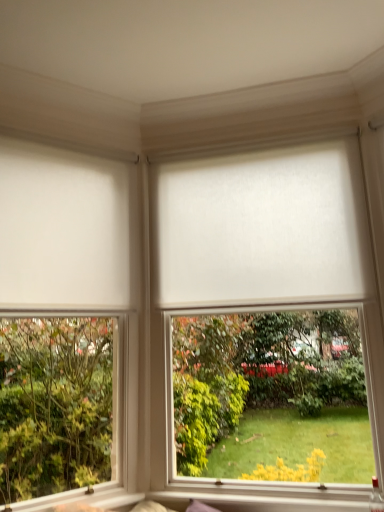
Question: Is white matte roller blind at center, positioned as the 1th window in right-to-left order, next to white matte blind at center, the 1th blind from the right?

Choices:
 (A) no
 (B) yes

Answer: (A)

Question: From the image's perspective, would you say white matte roller blind at center, positioned as the 2th window in left-to-right order, is positioned over white matte blind at center, the 1th blind from the right?

Choices:
 (A) yes
 (B) no

Answer: (B)

Question: Considering the relative positions of white matte roller blind at center, positioned as the 1th window in right-to-left order, and white matte blind at center, arranged as the second blind when viewed from the left, in the image provided, is white matte roller blind at center, positioned as the 1th window in right-to-left order, to the left of white matte blind at center, arranged as the second blind when viewed from the left, from the viewer's perspective?

Choices:
 (A) yes
 (B) no

Answer: (B)

Question: Considering the relative sizes of white matte roller blind at center, positioned as the 2th window in left-to-right order, and white matte blind at center, the 1th blind from the right, in the image provided, is white matte roller blind at center, positioned as the 2th window in left-to-right order, wider than white matte blind at center, the 1th blind from the right,?

Choices:
 (A) no
 (B) yes

Answer: (B)

Question: Is white matte roller blind at center, positioned as the 2th window in left-to-right order, facing away from white matte blind at center, arranged as the second blind when viewed from the left?

Choices:
 (A) yes
 (B) no

Answer: (A)

Question: Can you confirm if white matte roller blind at center, positioned as the 1th window in right-to-left order, is thinner than white matte blind at center, arranged as the second blind when viewed from the left?

Choices:
 (A) yes
 (B) no

Answer: (B)

Question: Does white matte roller blind at center, positioned as the 1th window in right-to-left order, have a lesser height compared to white matte roller blind at left, which ranks as the 1th window in left-to-right order?

Choices:
 (A) no
 (B) yes

Answer: (B)

Question: Does white matte roller blind at center, positioned as the 2th window in left-to-right order, have a greater height compared to white matte roller blind at left, the second window positioned from the right?

Choices:
 (A) no
 (B) yes

Answer: (A)

Question: Can you confirm if white matte roller blind at center, positioned as the 1th window in right-to-left order, is bigger than white matte roller blind at left, the second window positioned from the right?

Choices:
 (A) no
 (B) yes

Answer: (B)

Question: Does white matte roller blind at center, positioned as the 1th window in right-to-left order, lie in front of white matte roller blind at left, which ranks as the 1th window in left-to-right order?

Choices:
 (A) no
 (B) yes

Answer: (A)

Question: Can we say white matte roller blind at center, positioned as the 1th window in right-to-left order, lies outside white matte roller blind at left, the second window positioned from the right?

Choices:
 (A) no
 (B) yes

Answer: (B)

Question: From the image's perspective, does white matte roller blind at center, positioned as the 1th window in right-to-left order, appear higher than white matte roller blind at left, the second window positioned from the right?

Choices:
 (A) no
 (B) yes

Answer: (B)

Question: Considering the relative sizes of white matte roller blind at center, positioned as the 1th window in right-to-left order, and white matte blind at left, positioned as the 2th blind in right-to-left order, in the image provided, is white matte roller blind at center, positioned as the 1th window in right-to-left order, thinner than white matte blind at left, positioned as the 2th blind in right-to-left order,?

Choices:
 (A) no
 (B) yes

Answer: (A)